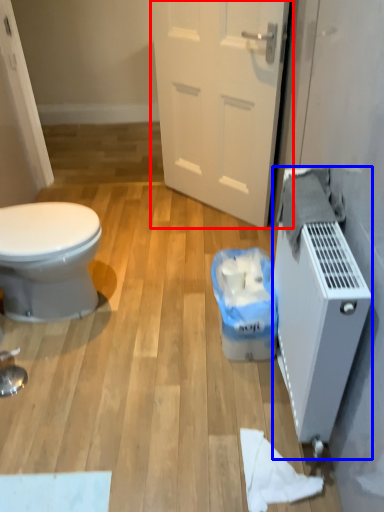
Question: Which object appears closest to the camera in this image, door (highlighted by a red box) or water heater (highlighted by a blue box)?

Choices:
 (A) door
 (B) water heater

Answer: (B)